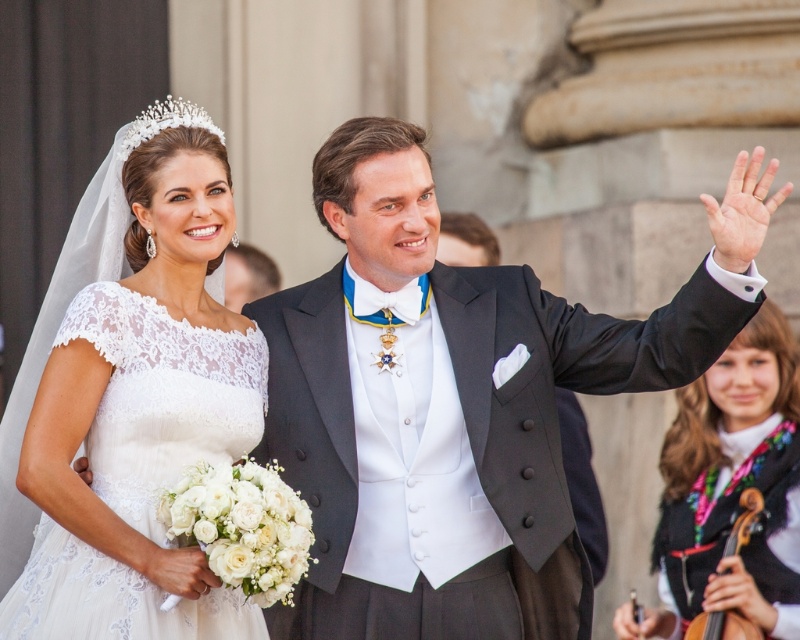
Question: Which point is farther to the camera?

Choices:
 (A) (656, 532)
 (B) (454, 250)
 (C) (360, 164)

Answer: (B)

Question: Is white lace dress at left to the right of wooden violin at lower right from the viewer's perspective?

Choices:
 (A) yes
 (B) no

Answer: (B)

Question: Which point is closer to the camera?

Choices:
 (A) white lace dress at lower right
 (B) pearl/pearly white tiara at upper center
 (C) black satin suit at center

Answer: (B)

Question: Which is nearer to the white lace dress at left?

Choices:
 (A) wooden violin at lower right
 (B) pearl/pearly white tiara at upper center
 (C) white lace dress at lower right

Answer: (B)

Question: Is shiny black suit at center to the left of white lace dress at lower right from the viewer's perspective?

Choices:
 (A) no
 (B) yes

Answer: (B)

Question: Does black satin suit at center appear over wooden violin at lower right?

Choices:
 (A) yes
 (B) no

Answer: (A)